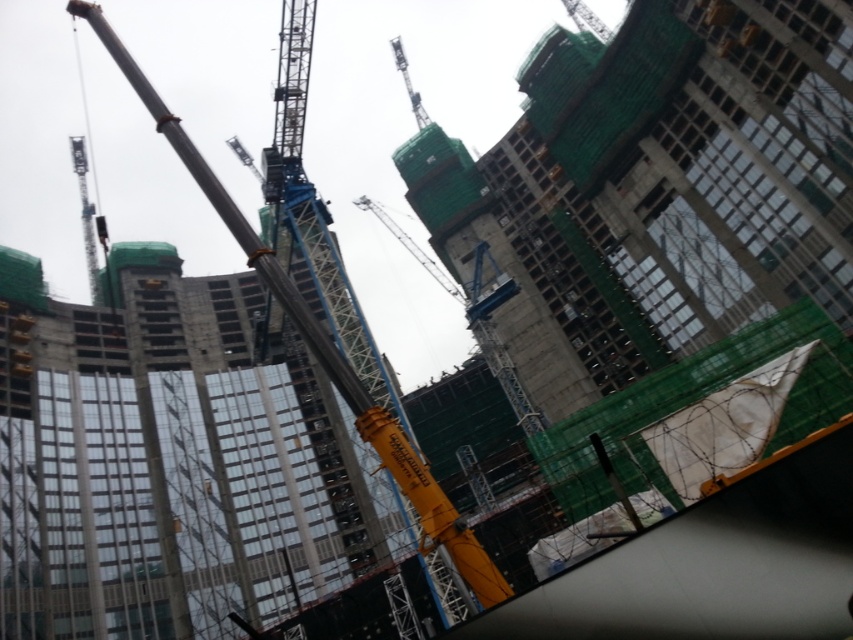
You are a construction worker trying to locate the concrete construction at center. From your position near the yellow metallic crane at center, which direction should you move to reach it?

The concrete construction at center is positioned on the right side of the yellow metallic crane at center, so you should move to the right to reach it.

You are an architect inspecting a construction site. You notice two structures at the center of the image labeled as concrete construction at center and concrete construction crane at center. Which one of these two structures is larger in size?

The concrete construction at center is bigger than the concrete construction crane at center.